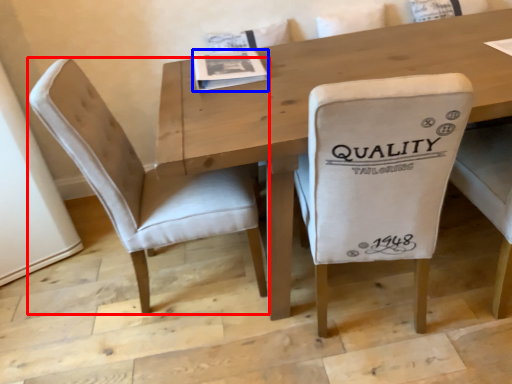
Question: Which object is further to the camera taking this photo, chair (highlighted by a red box) or magazine (highlighted by a blue box)?

Choices:
 (A) chair
 (B) magazine

Answer: (B)